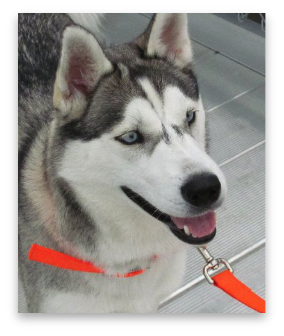
Where is `hook`? hook is located at coordinates (219, 260).